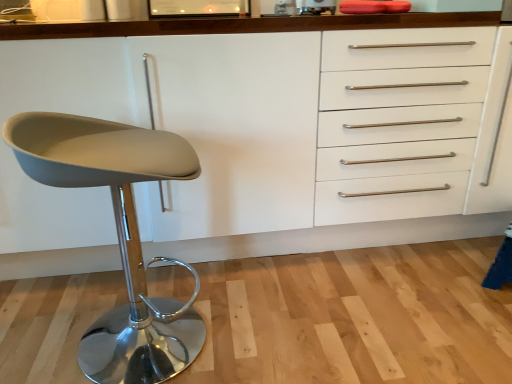
I want to click on vacant area located to the right-hand side of matte gray seat at left, so click(x=268, y=326).